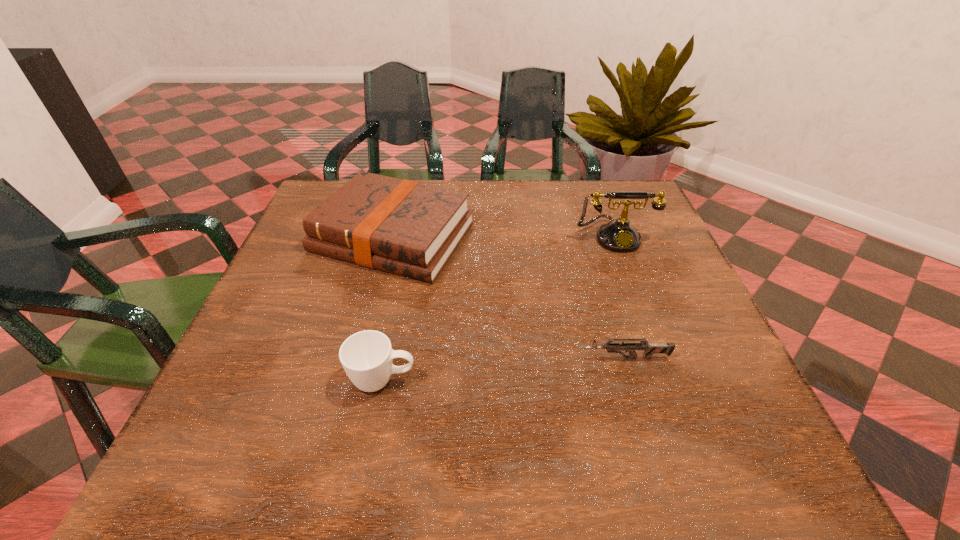
Locate an element on the screen. The width and height of the screenshot is (960, 540). free space that satisfies the following two spatial constraints: 1. on the dial of the telephone; 2. with the handle on the side of the nearest object is located at coordinates coord(668,380).